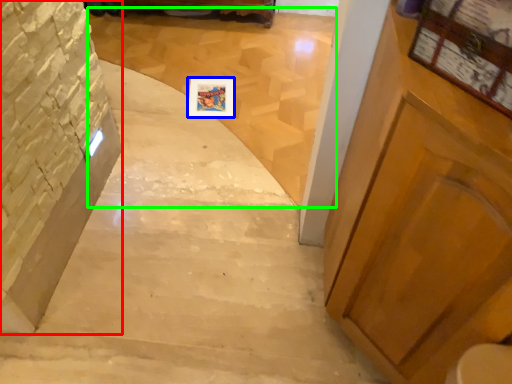
Question: Estimate the real-world distances between objects in this image. Which object is farther from stairwell (highlighted by a red box), picture frame (highlighted by a blue box) or stairwell (highlighted by a green box)?

Choices:
 (A) picture frame
 (B) stairwell

Answer: (B)